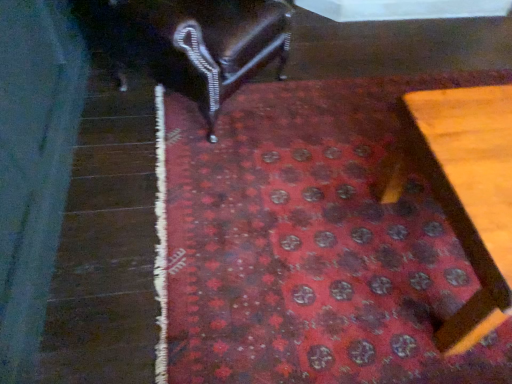
Find the location of `vacant area that is in front of shiny dark wood chair at upper left, placed as the first furniture when sorted from left to right`. vacant area that is in front of shiny dark wood chair at upper left, placed as the first furniture when sorted from left to right is located at coordinates (186, 193).